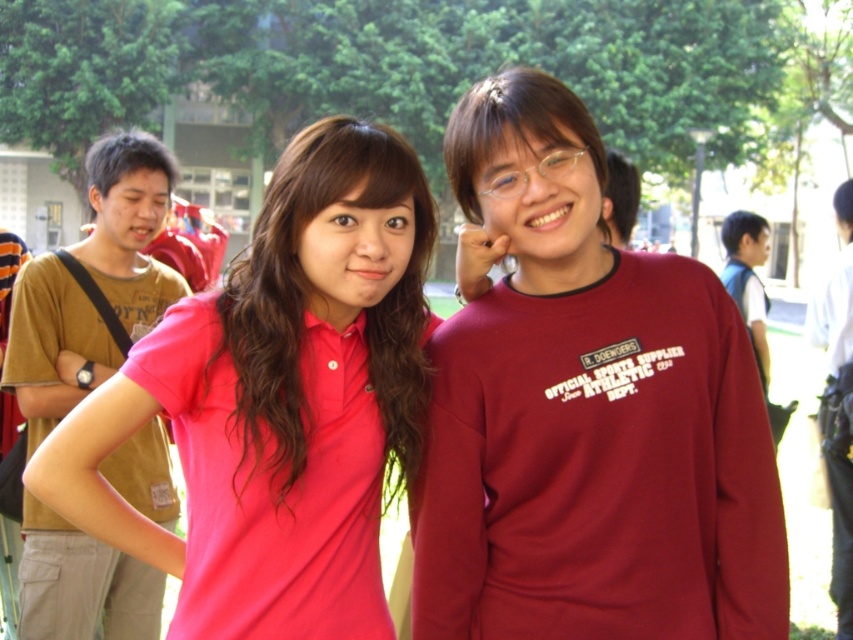
Is the position of maroon sweatshirt at center more distant than that of brown cotton t-shirt at left?

No.

Can you confirm if maroon sweatshirt at center is bigger than brown cotton t-shirt at left?

Yes, maroon sweatshirt at center is bigger than brown cotton t-shirt at left.

This screenshot has height=640, width=853. Describe the element at coordinates (585, 413) in the screenshot. I see `maroon sweatshirt at center` at that location.

Where is `maroon sweatshirt at center`? This screenshot has width=853, height=640. maroon sweatshirt at center is located at coordinates (585, 413).

Which is in front, point (581, 257) or point (334, 609)?

Positioned in front is point (334, 609).

Where is `maroon sweatshirt at center`? The width and height of the screenshot is (853, 640). maroon sweatshirt at center is located at coordinates (585, 413).

Describe the element at coordinates (277, 401) in the screenshot. I see `matte pink polo shirt at center` at that location.

Locate an element on the screen. The width and height of the screenshot is (853, 640). matte pink polo shirt at center is located at coordinates (277, 401).

Between point (341, 492) and point (758, 288), which one is positioned behind?

The point (758, 288) is more distant.

Identify the location of matte pink polo shirt at center. (277, 401).